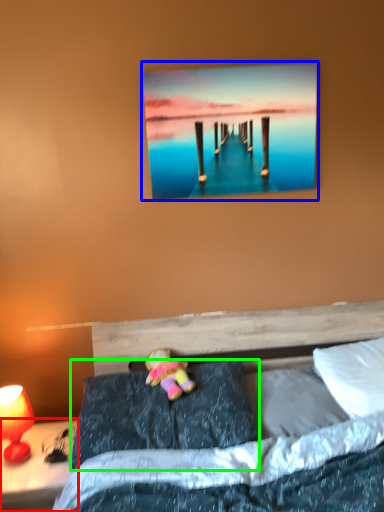
Question: Which object is positioned closest to nightstand (highlighted by a red box)? Select from picture frame (highlighted by a blue box) and pillow (highlighted by a green box).

Choices:
 (A) picture frame
 (B) pillow

Answer: (B)